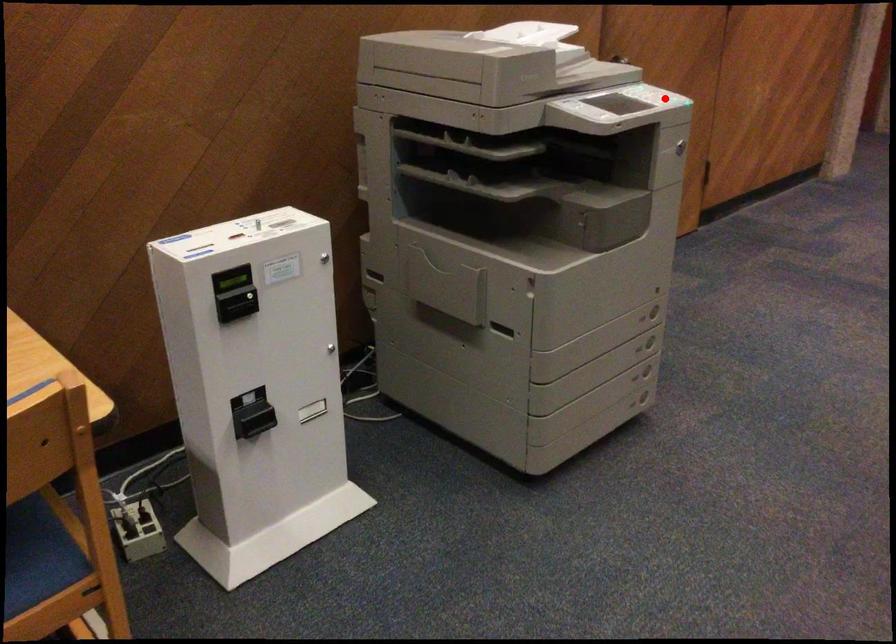
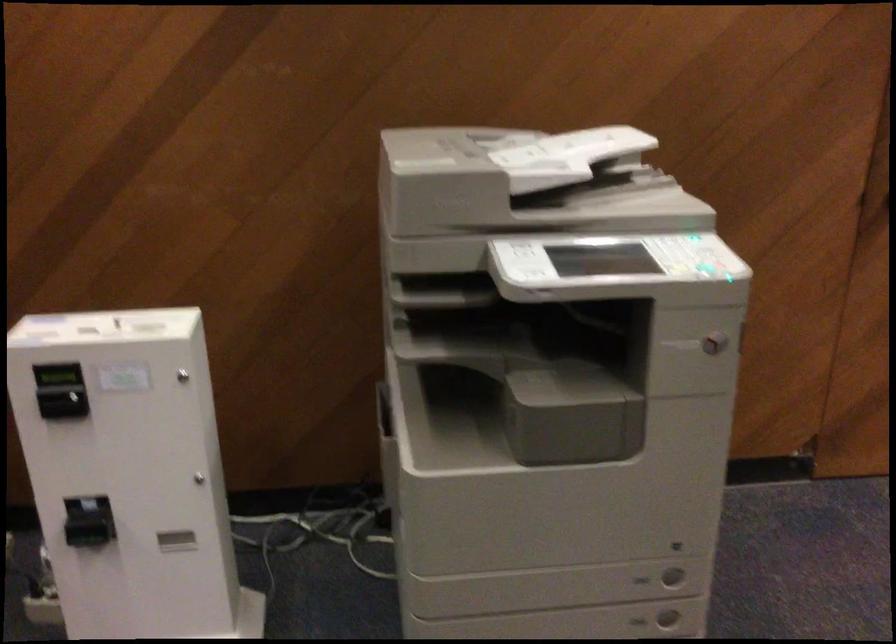
Question: I am providing you with two images of the same scene from different viewpoints. Given a red point in image1, look at the same physical point in image2. Is it:

Choices:
 (A) Closer to the viewpoint
 (B) Farther from the viewpoint

Answer: (A)